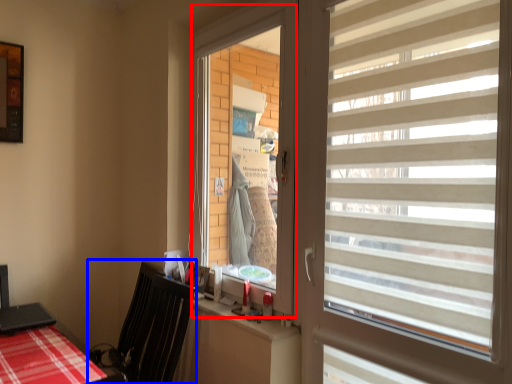
Question: Which object appears farthest to the camera in this image, window screen (highlighted by a red box) or swivel chair (highlighted by a blue box)?

Choices:
 (A) window screen
 (B) swivel chair

Answer: (A)